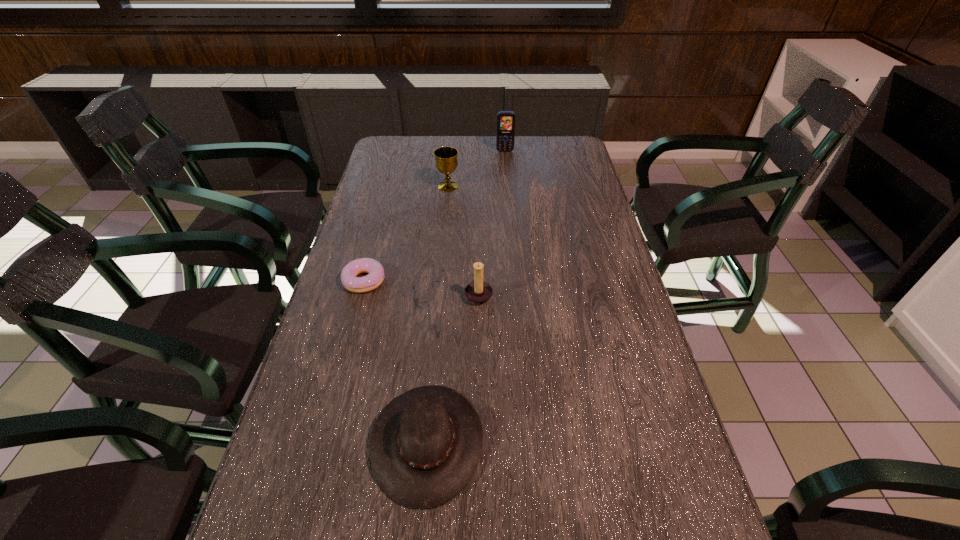
Where is `free point that satisfies the following two spatial constraints: 1. on the screen of the cellular telephone; 2. on the wick of the candle holder`? This screenshot has width=960, height=540. free point that satisfies the following two spatial constraints: 1. on the screen of the cellular telephone; 2. on the wick of the candle holder is located at coordinates (516, 294).